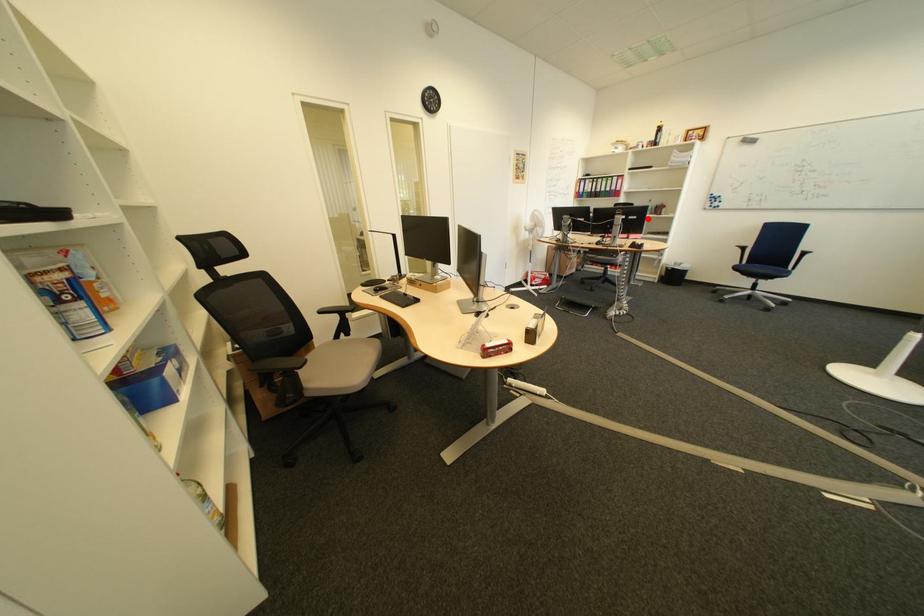
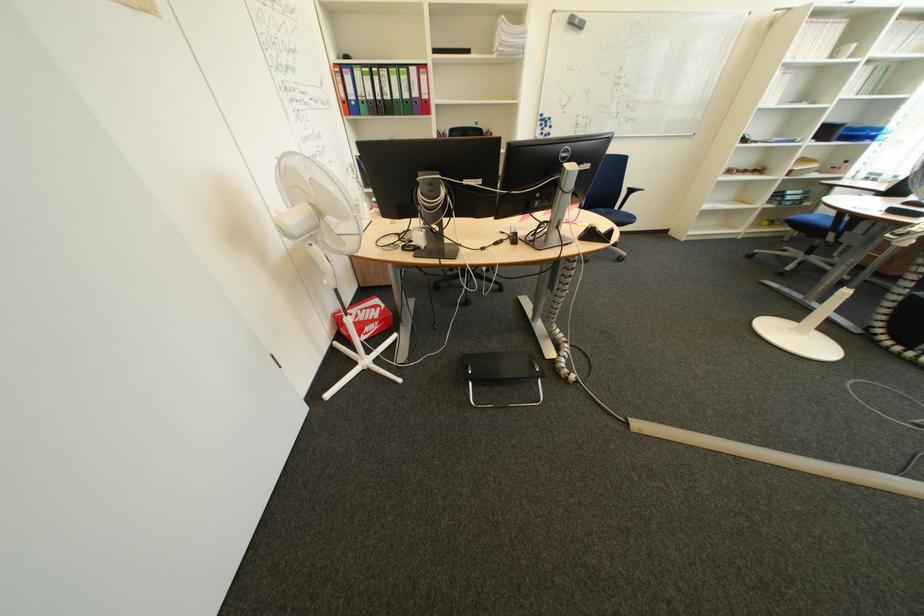
Find the pixel in the second image that matches the highlighted location in the first image.

(601, 168)